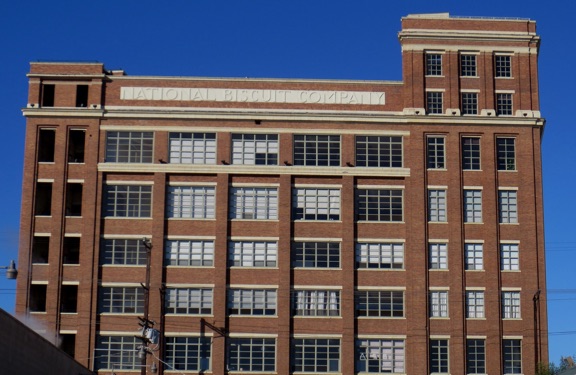
You are a GUI agent. You are given a task and a screenshot of the screen. Output one action in this format:
    pyautogui.click(x=<x>, y=<y>)
    Task: Click on the light
    The width and height of the screenshot is (576, 375).
    Given the screenshot: What is the action you would take?
    pyautogui.click(x=7, y=271)